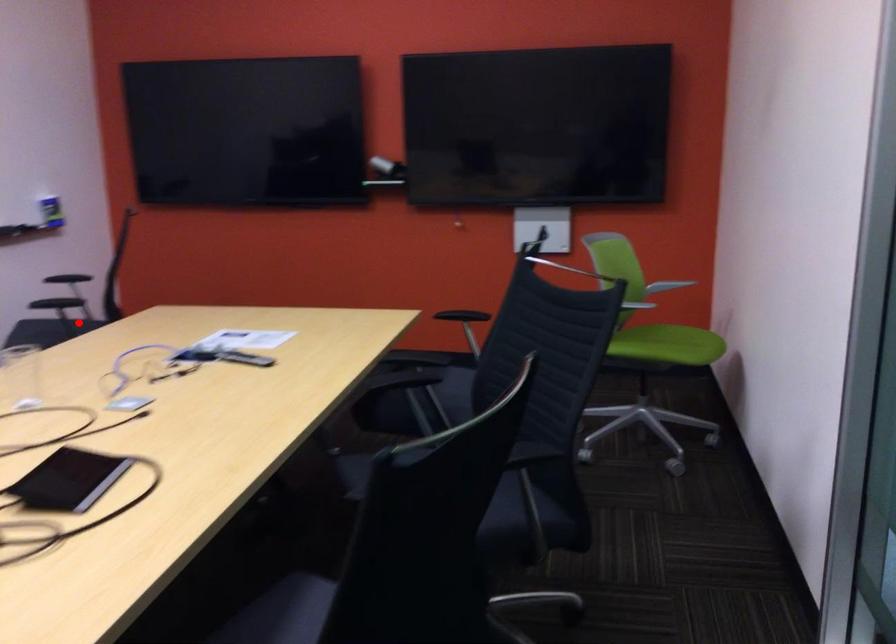
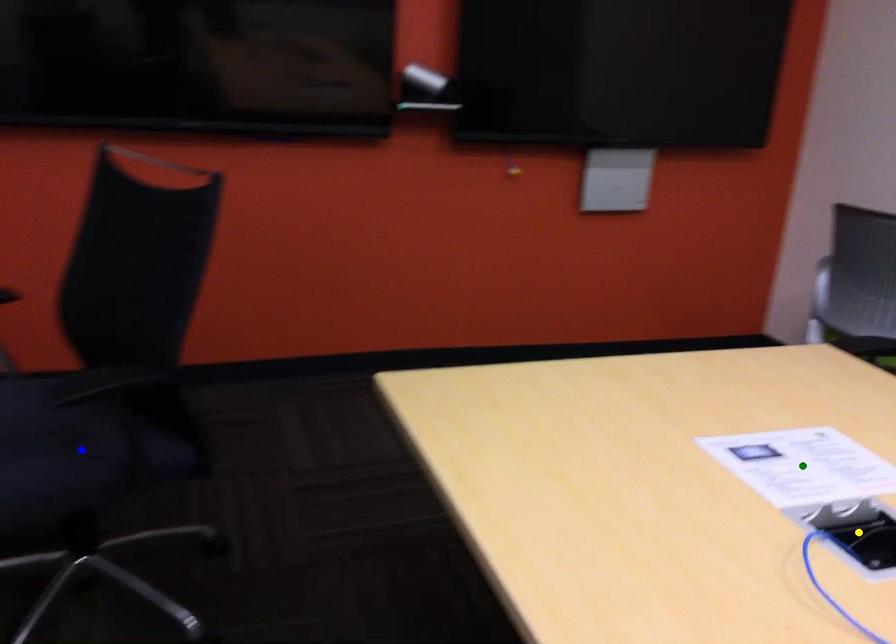
Question: I am providing you with two images of the same scene from different viewpoints. A red point is marked on the first image. You are given multiple points on the second image. Which point in image 2 is actually the same real-world point as the red point in image 1?

Choices:
 (A) blue point
 (B) green point
 (C) yellow point

Answer: (A)